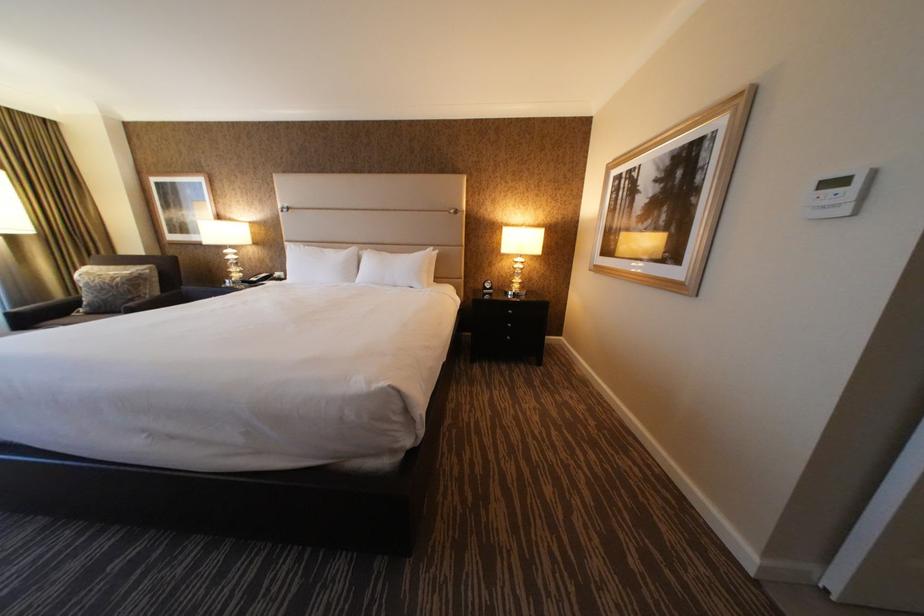
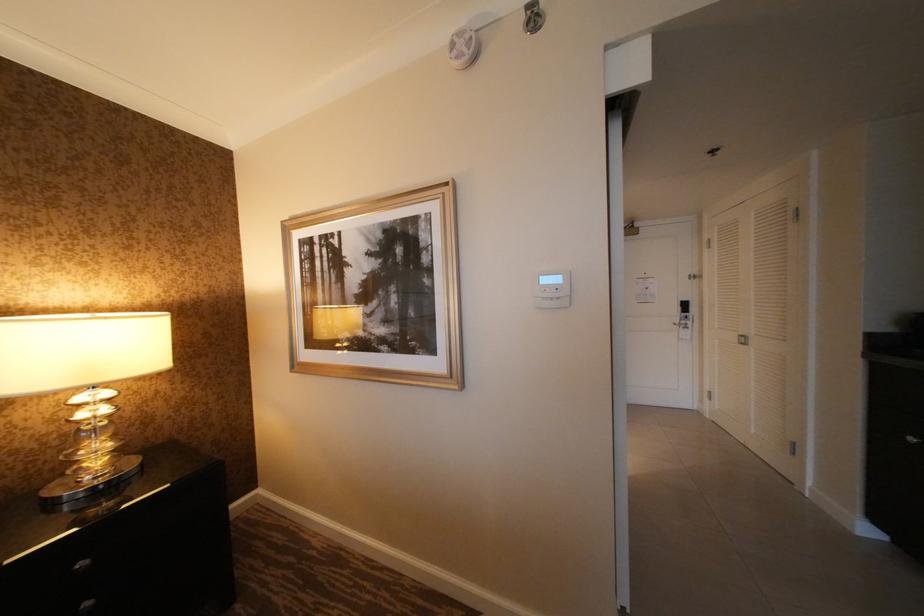
Question: The images are taken continuously from a first-person perspective. In which direction is your viewpoint rotating?

Choices:
 (A) Left
 (B) Right
 (C) Up
 (D) Down

Answer: (B)